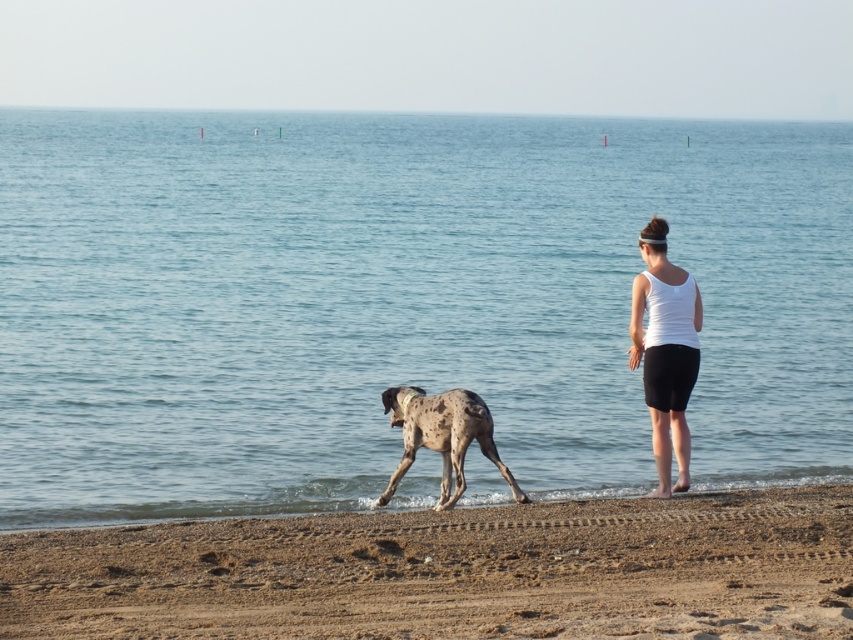
Between point (395, 252) and point (659, 280), which one is positioned behind?

The point (395, 252) is behind.

Which is above, blue water at center or white matte tank top at center?

blue water at center

What do you see at coordinates (401, 301) in the screenshot? The image size is (853, 640). I see `blue water at center` at bounding box center [401, 301].

This screenshot has height=640, width=853. What are the coordinates of `blue water at center` in the screenshot? It's located at (401, 301).

This screenshot has height=640, width=853. Describe the element at coordinates (401, 301) in the screenshot. I see `blue water at center` at that location.

Which is more to the left, blue water at center or spotted fur dog at center?

Positioned to the left is spotted fur dog at center.

Where is `blue water at center`? Image resolution: width=853 pixels, height=640 pixels. blue water at center is located at coordinates (401, 301).

How far apart are white matte tank top at center and spotted fur dog at center?

white matte tank top at center is 4.28 feet from spotted fur dog at center.

Consider the image. Who is lower down, white matte tank top at center or spotted fur dog at center?

Positioned lower is spotted fur dog at center.

Image resolution: width=853 pixels, height=640 pixels. What are the coordinates of `white matte tank top at center` in the screenshot? It's located at (664, 362).